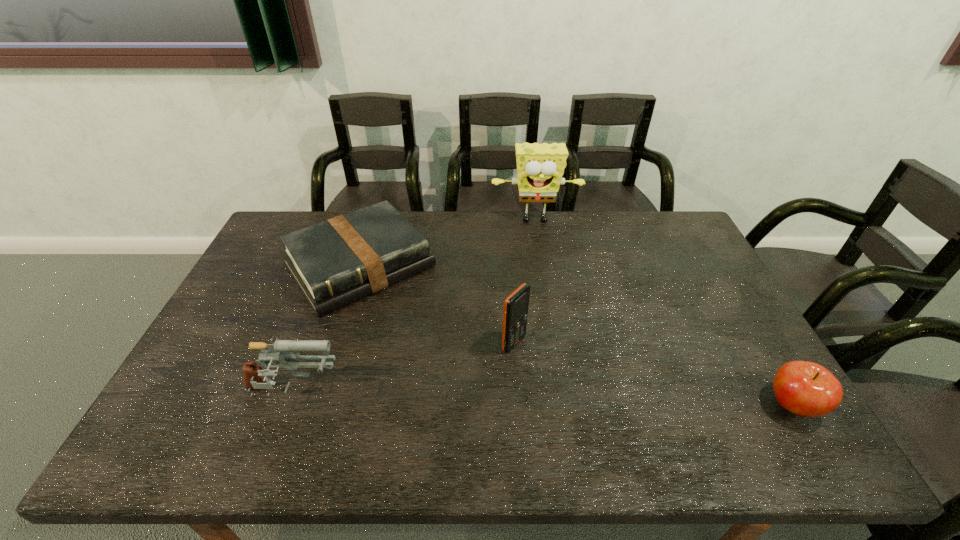
This screenshot has height=540, width=960. In order to click on the third shortest object in this screenshot , I will do `click(280, 351)`.

Where is `the second shortest object`? the second shortest object is located at coordinates (807, 389).

Image resolution: width=960 pixels, height=540 pixels. I want to click on the rightmost object, so pos(807,389).

This screenshot has height=540, width=960. I want to click on the shortest object, so click(x=336, y=262).

Find the location of a particular element. The width and height of the screenshot is (960, 540). cellular telephone is located at coordinates [516, 305].

Image resolution: width=960 pixels, height=540 pixels. I want to click on the tallest object, so click(x=540, y=167).

Find the location of a particular element. The image size is (960, 540). free space located at the barrel end of the gun is located at coordinates 491,393.

This screenshot has height=540, width=960. In order to click on free space located on the left of the second shortest object in this screenshot , I will do `click(633, 405)`.

You are a GUI agent. You are given a task and a screenshot of the screen. Output one action in this format:
    pyautogui.click(x=<x>, y=<y>)
    Task: Click on the vacant space positioned 0.080m on the spine side of the hardback book
    Image resolution: width=960 pixels, height=540 pixels.
    Given the screenshot: What is the action you would take?
    pyautogui.click(x=410, y=325)

Find the location of a particular element. free region located on the spine side of the hardback book is located at coordinates (422, 340).